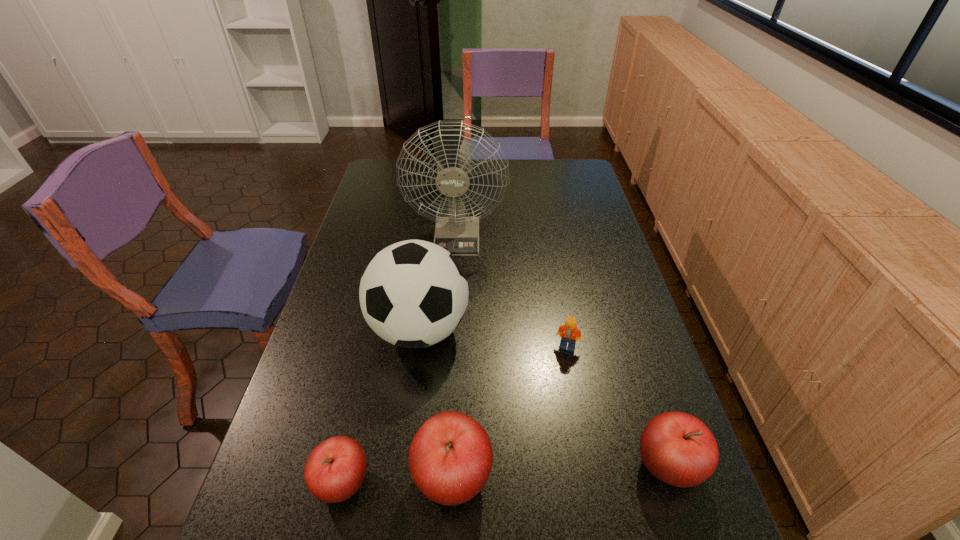
This screenshot has width=960, height=540. Identify the location of blank area located on the left of the second shortest apple. (516, 466).

Where is `vacant point located on the back of the soccer ball`? vacant point located on the back of the soccer ball is located at coordinates (426, 281).

Identify the location of free spot located on the air flow direction of the farthest object. The height and width of the screenshot is (540, 960). (451, 329).

You are a GUI agent. You are given a task and a screenshot of the screen. Output one action in this format:
    pyautogui.click(x=<x>, y=<y>)
    Task: Click on the vacant space positioned 0.100m on the front-facing side of the Lego
    
    Given the screenshot: What is the action you would take?
    pyautogui.click(x=574, y=384)

Find the location of a particular element. This screenshot has width=960, height=540. apple present at the left edge is located at coordinates (334, 471).

This screenshot has height=540, width=960. I want to click on soccer ball that is positioned at the left edge, so click(x=413, y=294).

The height and width of the screenshot is (540, 960). Identify the location of object at the right edge. coord(677,448).

Locate an element on the screen. object that is at the near left corner is located at coordinates (334, 471).

Identify the location of object located in the near right corner section of the desktop. (677, 448).

The image size is (960, 540). What are the coordinates of `vacant area at the far edge of the desktop` in the screenshot? It's located at (545, 173).